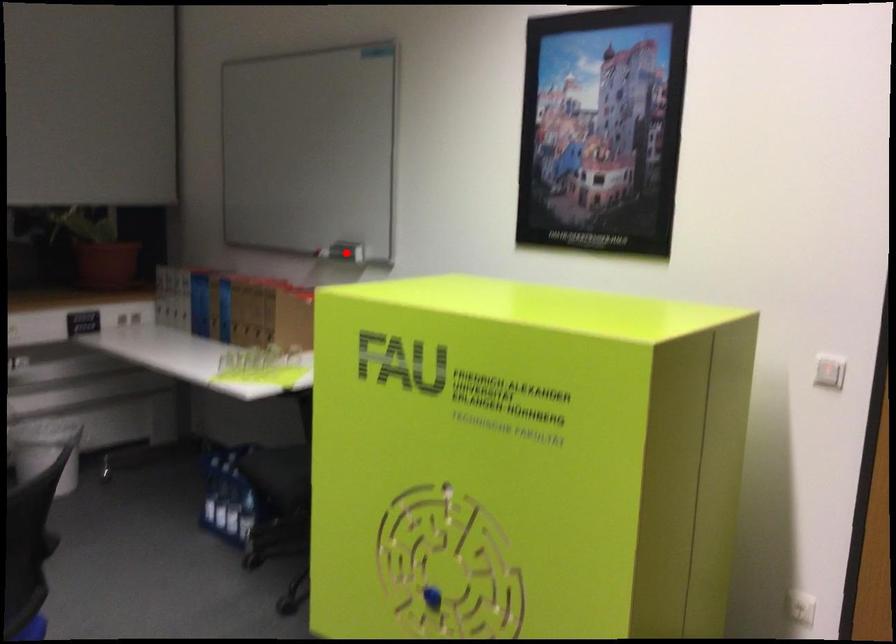
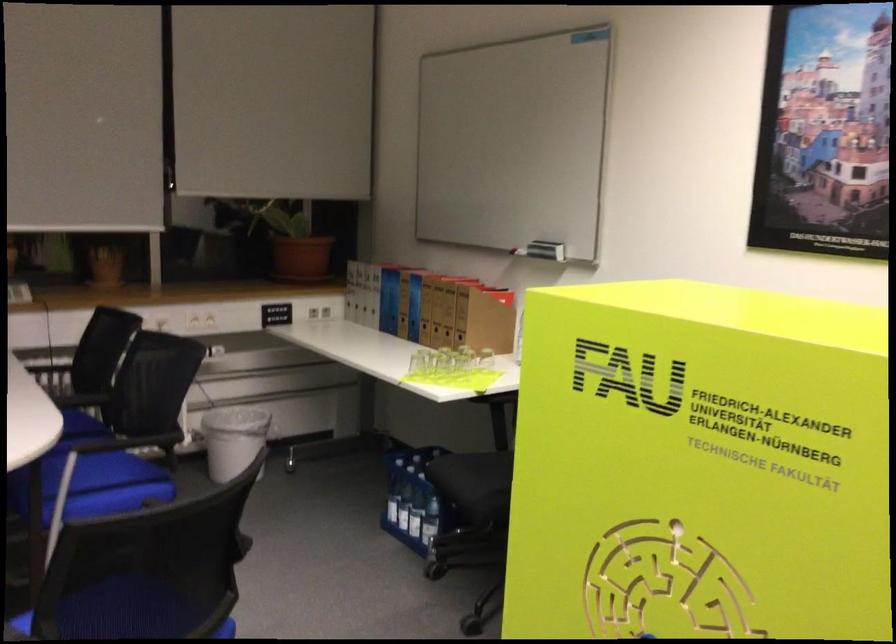
In the second image, find the point that corresponds to the highlighted location in the first image.

(546, 250)